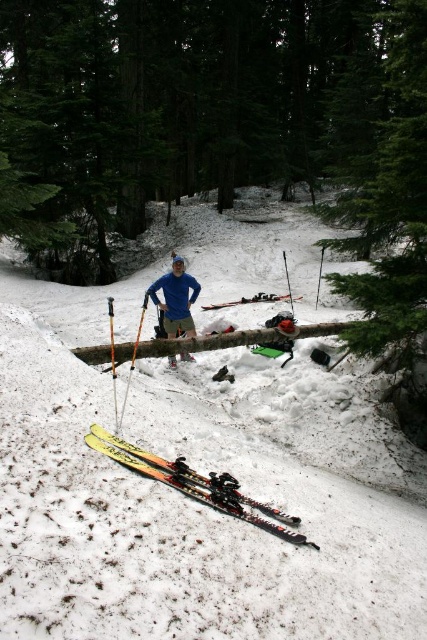
You are standing at the base of the snowy forest scene and want to reach the closest point between the two points marked as point (193, 490) and point (201, 307). Which point should you head towards?

You should head towards point (193, 490) because it is closer to you than point (201, 307).

You are a person in the snowy forest scene. You want to pick up the yellow matte skis at lower left and the matte black skis at center. Which pair of skis is closer to your current position?

The yellow matte skis at lower left is positioned under the matte black skis at center, so the yellow matte skis at lower left is closer to your current position.

You are a photographer trying to capture a clear shot of the blue fabric pants at center and the yellow plastic ski pole at center. Which object will appear larger in your photo?

The blue fabric pants at center will appear larger in the photo because it is closer to the viewer than the yellow plastic ski pole at center.